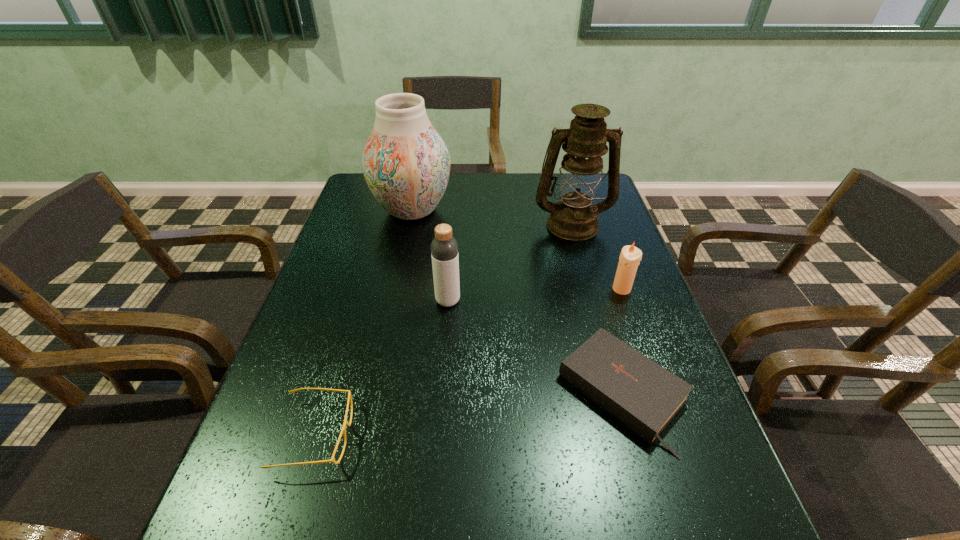
In order to click on the fifth closest object to the oil lamp in this screenshot , I will do (x=343, y=430).

In order to click on object that ranks as the second closest to the Bible in this screenshot , I will do `click(444, 248)`.

Identify the location of free location that satisfies the following two spatial constraints: 1. on the front side of the candle; 2. on the right side of the oil lamp. (590, 289).

At what (x,y) coordinates should I click in order to perform the action: click on blank space that satisfies the following two spatial constraints: 1. on the back side of the Bible; 2. on the left side of the fourth tallest object. Please return your answer as a coordinate pair (x, y). The image size is (960, 540). Looking at the image, I should click on (593, 289).

Locate an element on the screen. This screenshot has height=540, width=960. free region that satisfies the following two spatial constraints: 1. on the front side of the vase; 2. on the left side of the Bible is located at coordinates (373, 393).